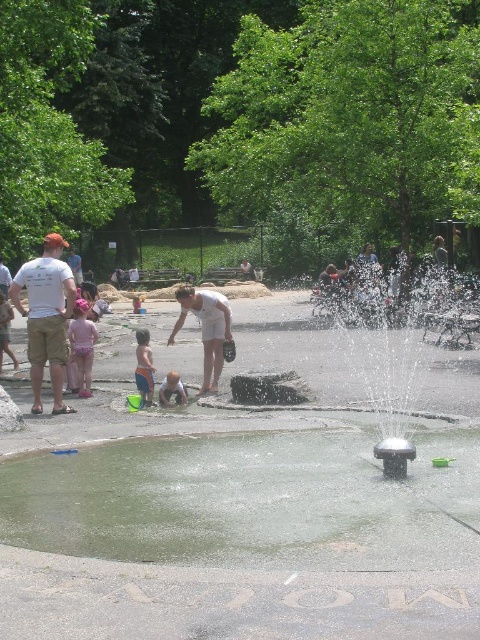
Question: In this image, where is clear water at center located relative to white t-shirt at left?

Choices:
 (A) left
 (B) right

Answer: (B)

Question: Does white cotton shirt at center have a larger size compared to pink fabric dress at left?

Choices:
 (A) no
 (B) yes

Answer: (B)

Question: Which object is the closest to the metallic gray fountain at center?

Choices:
 (A) white t-shirt at left
 (B) white cotton shirt at center
 (C) light blue fabric pants at center

Answer: (B)

Question: Does clear water at center have a greater width compared to light blue shorts at lower left?

Choices:
 (A) yes
 (B) no

Answer: (A)

Question: Considering the real-world distances, which object is closest to the white cotton shirt at center?

Choices:
 (A) white t-shirt at left
 (B) metallic gray fountain at center
 (C) clear water at center

Answer: (A)

Question: Which point appears farthest from the camera in this image?

Choices:
 (A) (196, 298)
 (B) (94, 328)
 (C) (180, 384)
 (D) (226, 442)

Answer: (B)